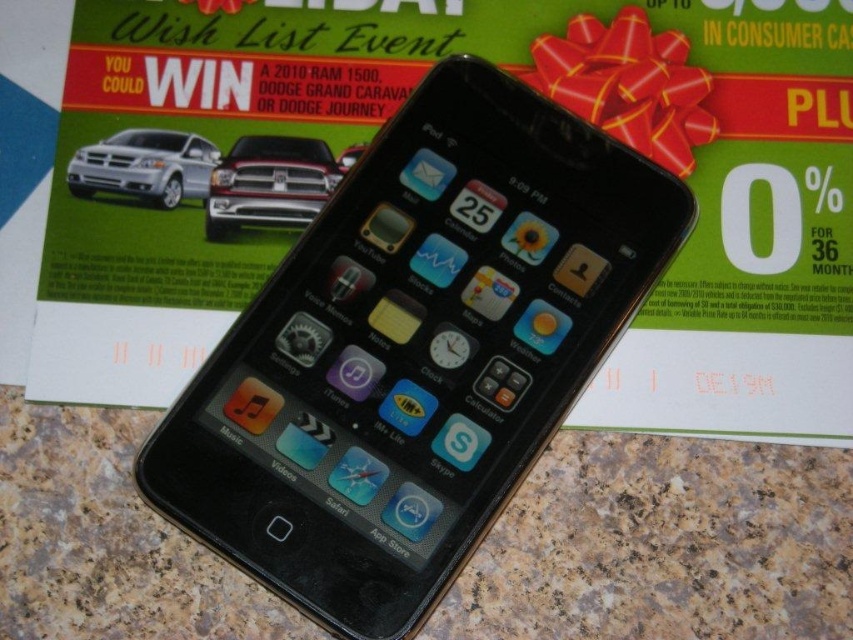
Between point (262, 593) and point (169, 184), which one is positioned in front?

Point (262, 593) is more forward.

Does brown marble counter top at lower center appear under silver metallic car at upper left?

Correct, brown marble counter top at lower center is located below silver metallic car at upper left.

Describe the element at coordinates (664, 545) in the screenshot. I see `brown marble counter top at lower center` at that location.

Where is `brown marble counter top at lower center`? brown marble counter top at lower center is located at coordinates (664, 545).

Between point (498, 136) and point (245, 189), which one is positioned behind?

The point (498, 136) is more distant.

Who is lower down, black plastic smartphone at center or matte black truck at center?

black plastic smartphone at center

Is point (404, 586) farther from camera compared to point (287, 195)?

No, it is not.

The image size is (853, 640). I want to click on black plastic smartphone at center, so click(x=415, y=349).

Which of these two, black plastic smartphone at center or brown marble counter top at lower center, stands shorter?

brown marble counter top at lower center is shorter.

You are a GUI agent. You are given a task and a screenshot of the screen. Output one action in this format:
    pyautogui.click(x=<x>, y=<y>)
    Task: Click on the black plastic smartphone at center
    The image size is (853, 640).
    Given the screenshot: What is the action you would take?
    pyautogui.click(x=415, y=349)